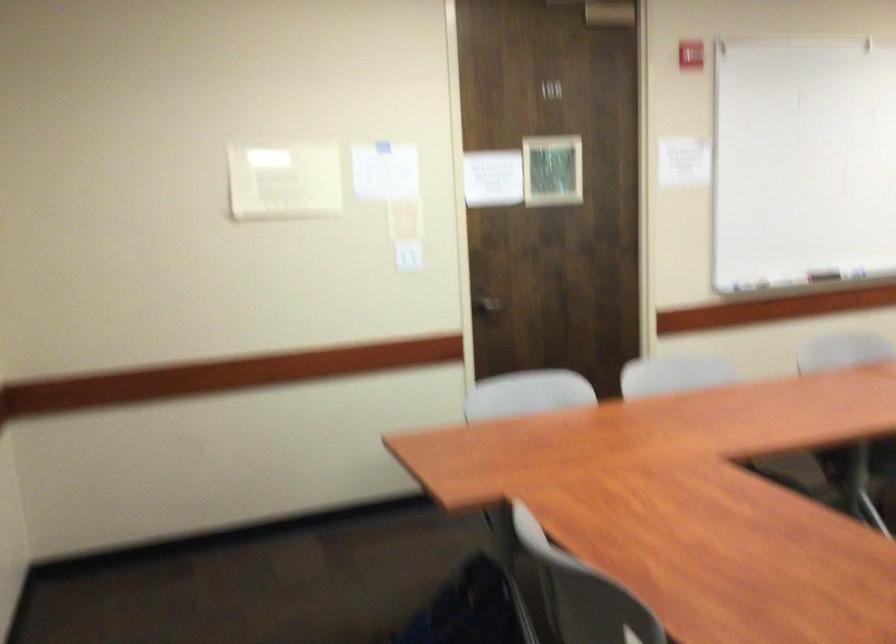
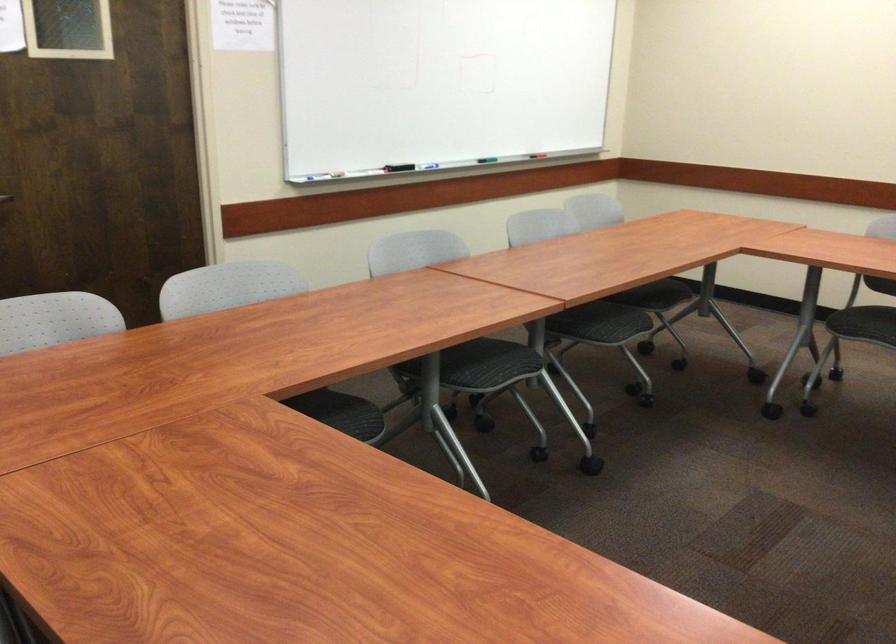
Find the pixel in the second image that matches point 717,412 in the first image.

(265, 330)